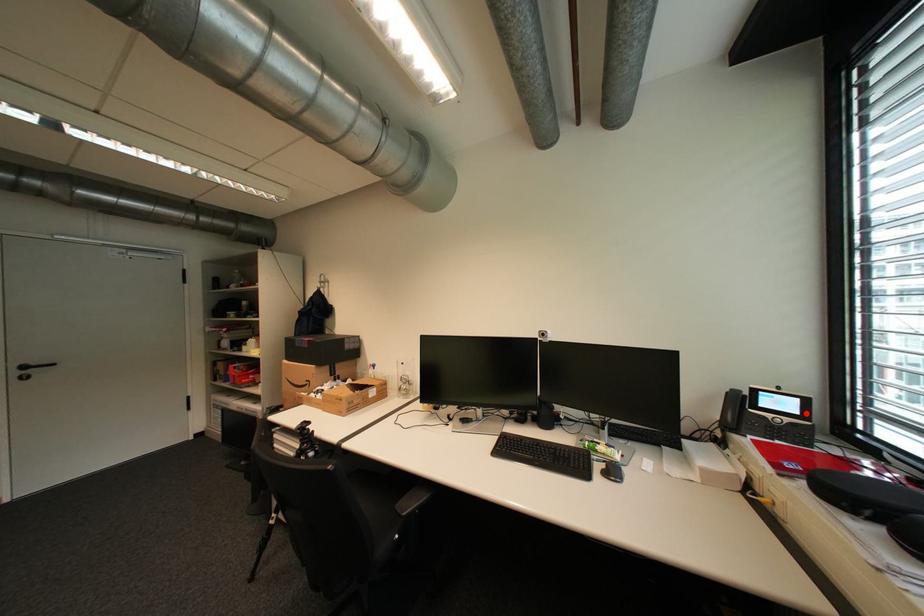
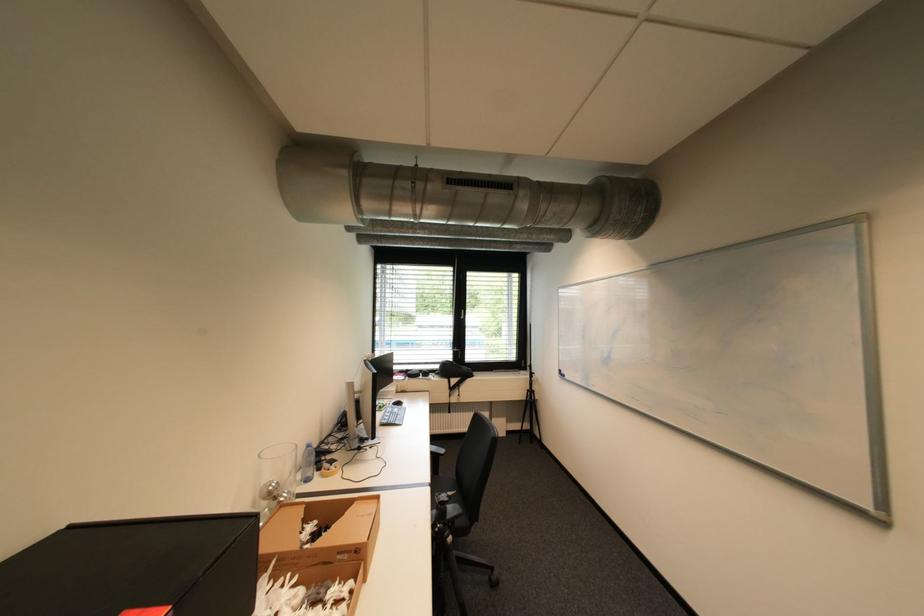
Question: I am providing you with two images of the same scene from different viewpoints. A red point is marked on the first image. Can you still see the location of the red point in image 2?

Choices:
 (A) Yes
 (B) No

Answer: (B)